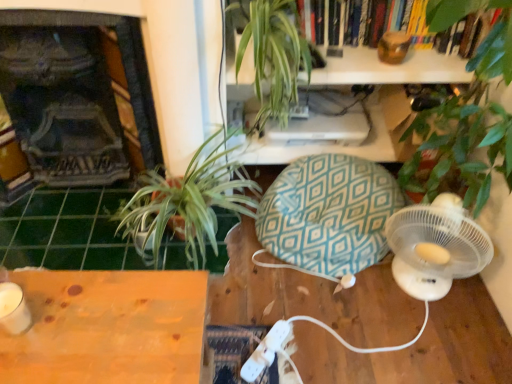
Locate an element on the screen. The height and width of the screenshot is (384, 512). vacant space to the right of white plastic wii controller at lower center is located at coordinates (314, 346).